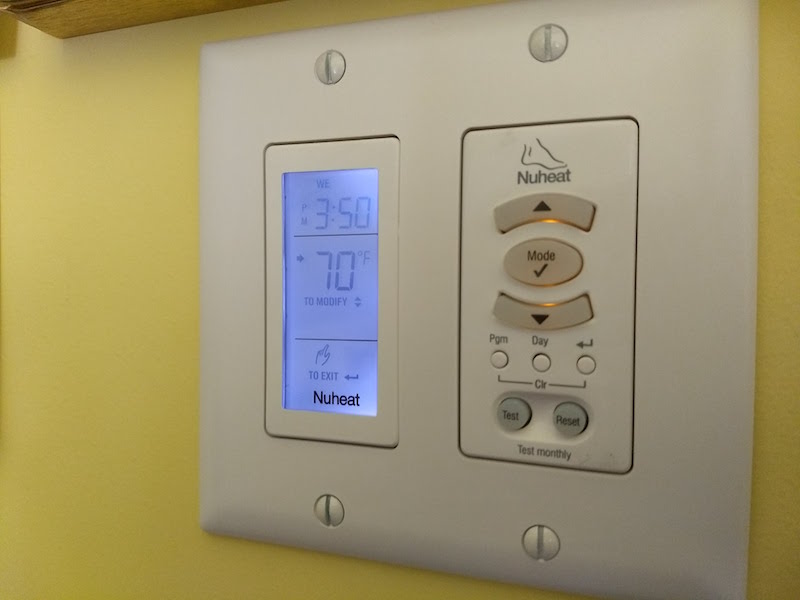
Where is `white switch plate`? The image size is (800, 600). white switch plate is located at coordinates (469, 527).